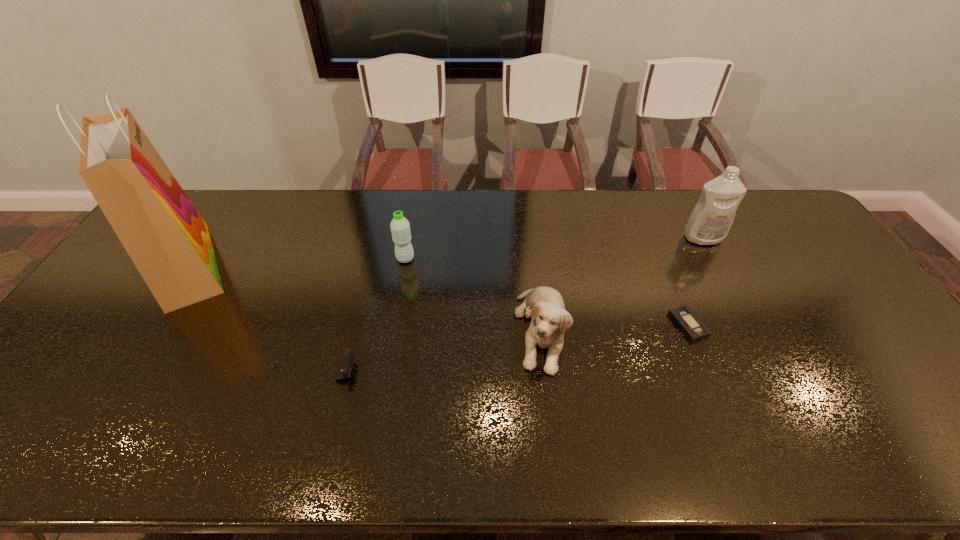
Where is `object present at the left edge`? Image resolution: width=960 pixels, height=540 pixels. object present at the left edge is located at coordinates (168, 241).

Locate an element on the screen. The height and width of the screenshot is (540, 960). object positioned at the far left corner is located at coordinates (168, 241).

Identify the location of vacant space at the far edge. (316, 195).

Where is `free space at the left edge of the desktop`? This screenshot has height=540, width=960. free space at the left edge of the desktop is located at coordinates (94, 356).

At what (x,y) coordinates should I click in order to perform the action: click on free space at the right edge of the desktop. Please return your answer as a coordinate pair (x, y). The width and height of the screenshot is (960, 540). Looking at the image, I should click on (876, 358).

At what (x,y) coordinates should I click in order to perform the action: click on free location at the far left corner of the desktop. Please return your answer as a coordinate pair (x, y). Looking at the image, I should click on (210, 194).

Where is `empty location between the fourth tallest object and the second object from left to right`? This screenshot has width=960, height=540. empty location between the fourth tallest object and the second object from left to right is located at coordinates (425, 352).

At what (x,y) coordinates should I click in order to perform the action: click on vacant area between the second shortest object and the shopping bag. Please return your answer as a coordinate pair (x, y). The image size is (960, 540). Looking at the image, I should click on (249, 320).

Identify the location of vacant area that lies between the shortest object and the shopping bag. The height and width of the screenshot is (540, 960). [x=438, y=295].

You are a GUI agent. You are given a task and a screenshot of the screen. Output one action in this format:
    pyautogui.click(x=<x>, y=<y>)
    Task: Click on the unoccupied position between the fourth object from right to left and the second shortest object
    The height and width of the screenshot is (540, 960).
    Given the screenshot: What is the action you would take?
    pyautogui.click(x=358, y=316)